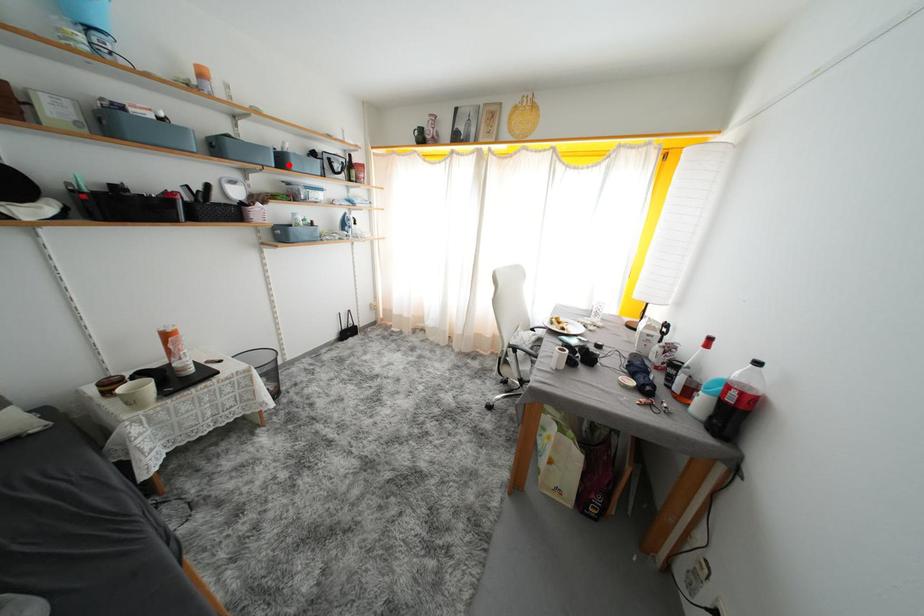
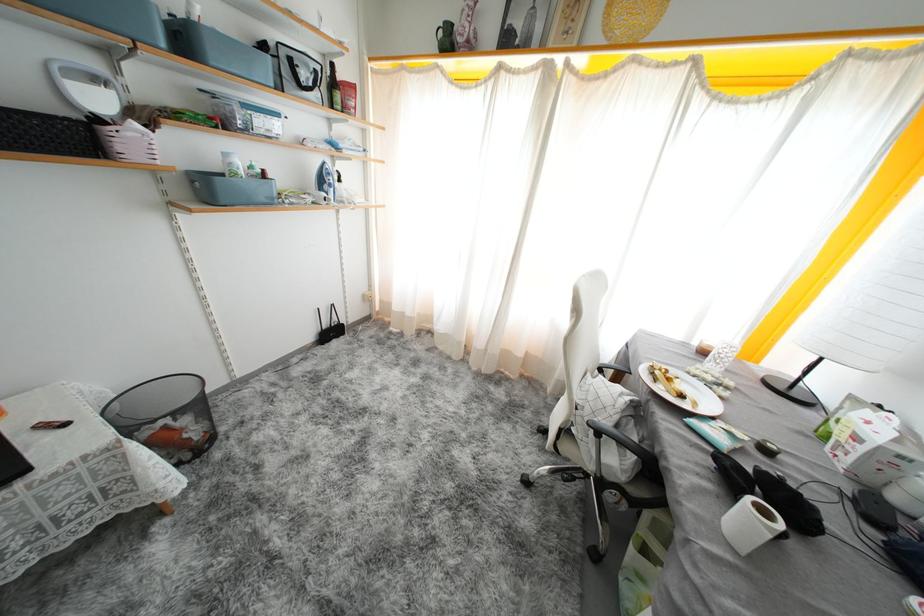
Question: I am providing you with two images of the same scene from different viewpoints. Given a red point in image1, look at the same physical point in image2. Is it:

Choices:
 (A) Closer to the viewpoint
 (B) Farther from the viewpoint

Answer: (B)